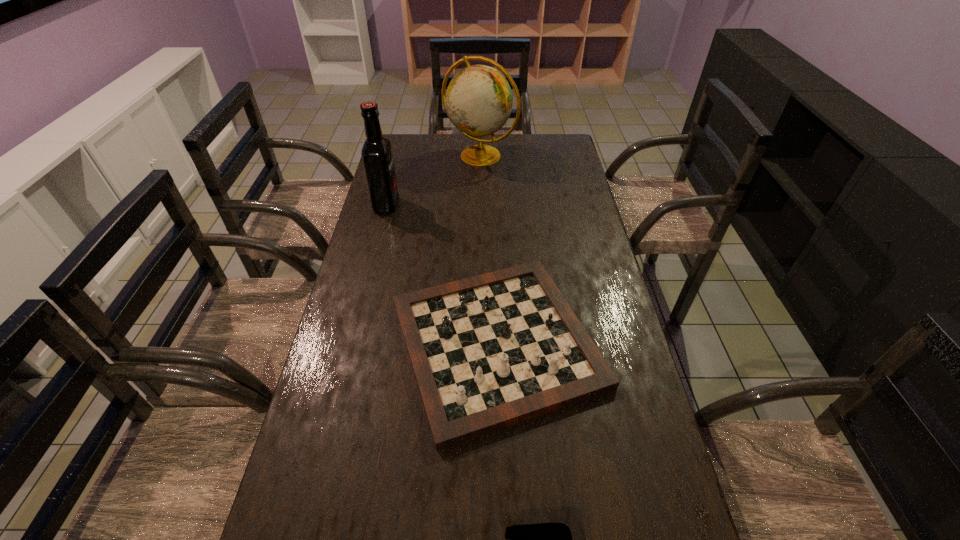
Locate an element on the screen. The height and width of the screenshot is (540, 960). the farthest object is located at coordinates (479, 100).

Where is `the leftmost object`? the leftmost object is located at coordinates pos(376,152).

Identify the location of liquor. (376, 152).

In order to click on the second shortest object in this screenshot , I will do `click(489, 351)`.

The height and width of the screenshot is (540, 960). In order to click on the third farthest object in this screenshot , I will do `click(489, 351)`.

Where is `free region located on the left of the farthest object`? The height and width of the screenshot is (540, 960). free region located on the left of the farthest object is located at coordinates (388, 156).

Find the location of `vacant region located 0.240m on the front-facing side of the liquor`. vacant region located 0.240m on the front-facing side of the liquor is located at coordinates (465, 205).

Where is `vacant position located on the back of the chessboard`? The height and width of the screenshot is (540, 960). vacant position located on the back of the chessboard is located at coordinates (493, 249).

Locate an element on the screen. The width and height of the screenshot is (960, 540). object situated at the far edge is located at coordinates (479, 100).

I want to click on liquor that is at the left edge, so click(x=376, y=152).